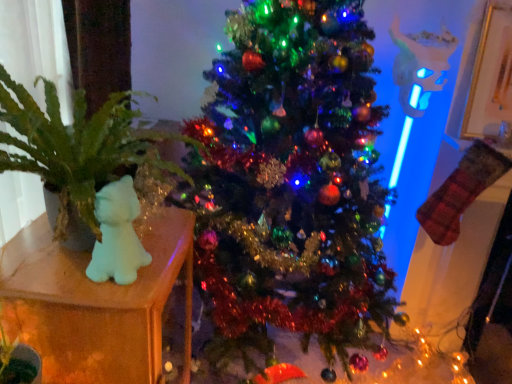
Locate an element on the screen. The width and height of the screenshot is (512, 384). free space above translucent plastic bear at left (from a real-world perspective) is located at coordinates (86, 250).